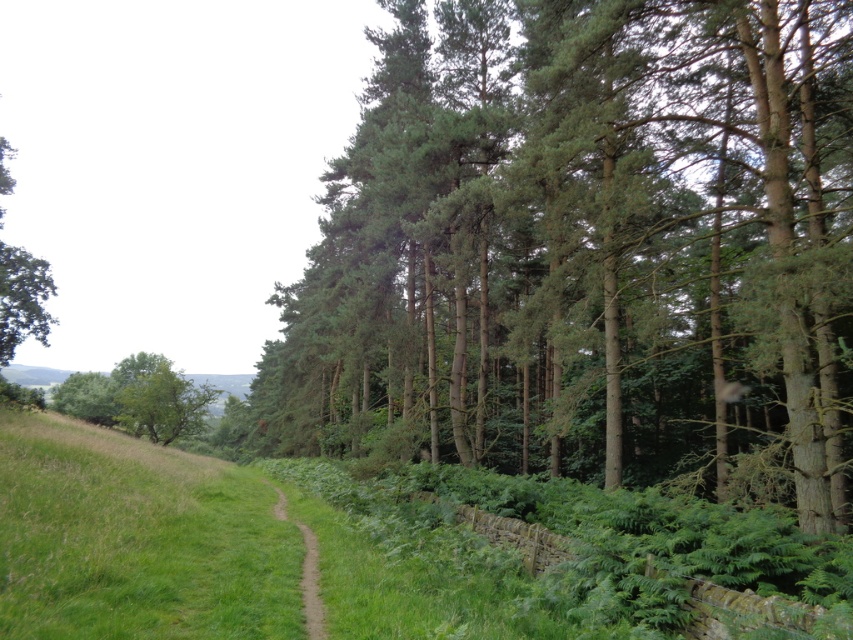
Question: Among these points, which one is nearest to the camera?

Choices:
 (A) (556, 200)
 (B) (323, 632)

Answer: (B)

Question: Considering the relative positions of green textured trees at center and brown dirt path at center in the image provided, where is green textured trees at center located with respect to brown dirt path at center?

Choices:
 (A) right
 (B) left

Answer: (A)

Question: Does green textured trees at center have a greater width compared to brown dirt path at center?

Choices:
 (A) no
 (B) yes

Answer: (B)

Question: Can you confirm if green textured trees at center is thinner than brown dirt path at center?

Choices:
 (A) no
 (B) yes

Answer: (A)